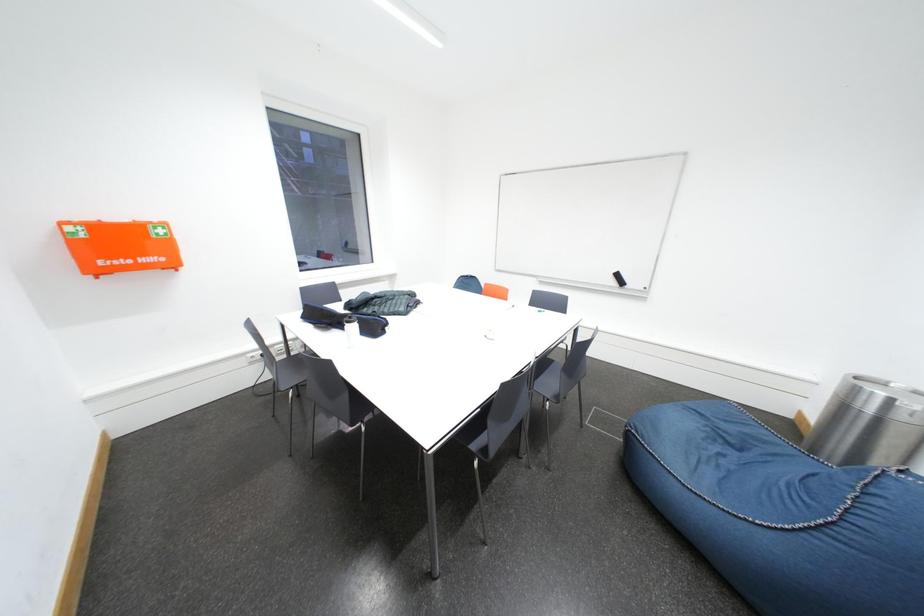
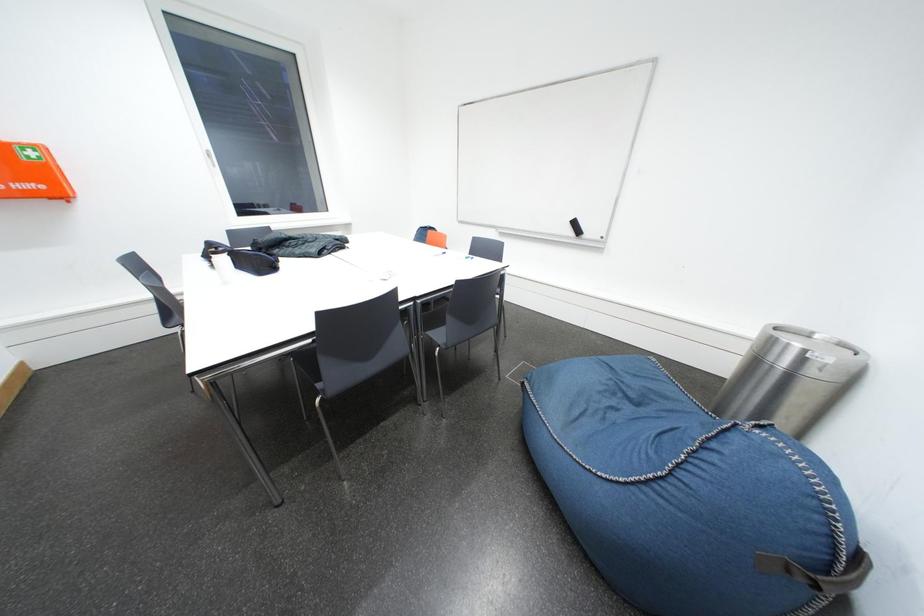
Question: What movement of the cameraman would produce the second image?

Choices:
 (A) Left
 (B) Right
 (C) Forward
 (D) Backward

Answer: (B)